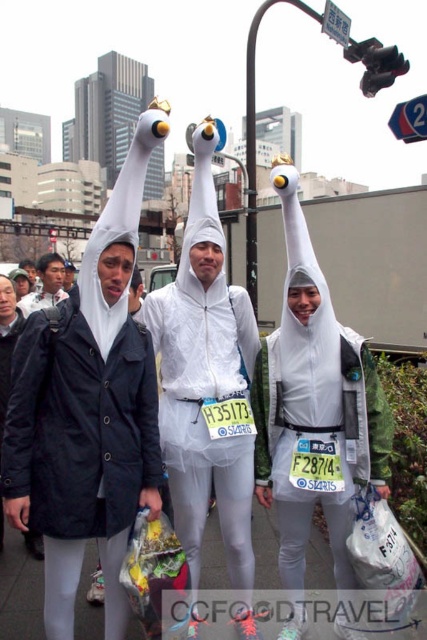
Between white fabric pants at center and matte black jacket at left, which one has less height?

white fabric pants at center

Which is behind, point (84, 620) or point (63, 298)?

The point (63, 298) is behind.

I want to click on white fabric pants at center, so click(20, 589).

Describe the element at coordinates (315, 406) in the screenshot. I see `white matte swan at center` at that location.

Where is `white matte swan at center`? The height and width of the screenshot is (640, 427). white matte swan at center is located at coordinates click(315, 406).

Where is `white matte swan at center`? white matte swan at center is located at coordinates (315, 406).

The width and height of the screenshot is (427, 640). I want to click on white matte swan at center, so click(x=315, y=406).

You are a GUI agent. You are given a task and a screenshot of the screen. Output one action in this format:
    pyautogui.click(x=<x>, y=<y>)
    Task: Click on the white matte costume at center
    This screenshot has height=640, width=427.
    Given the screenshot: What is the action you would take?
    pyautogui.click(x=205, y=380)

Can you confirm if white matte costume at center is thinner than matte black jacket at left?

Yes, white matte costume at center is thinner than matte black jacket at left.

What are the coordinates of `white matte costume at center` in the screenshot? It's located at [x=205, y=380].